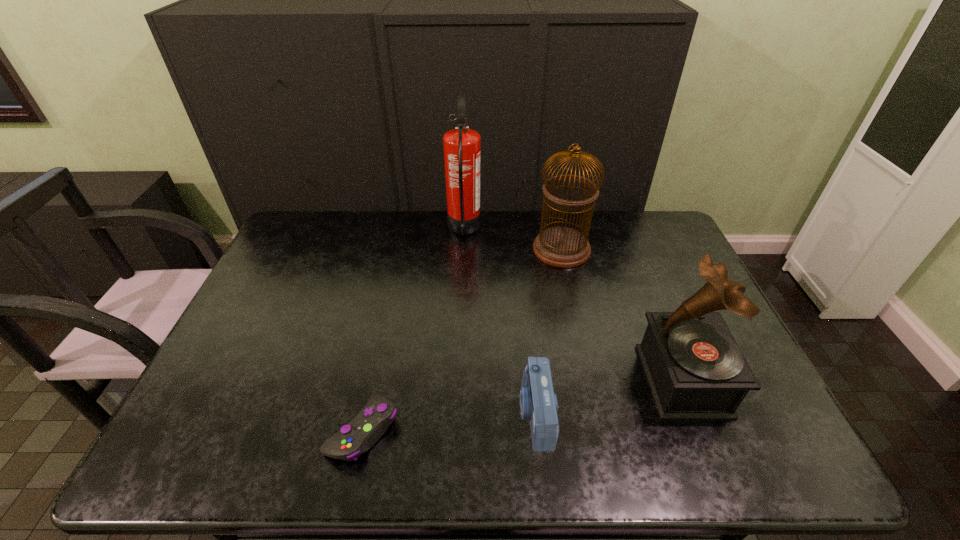
What are the coordinates of `free space located on the front-facing side of the fourth object from left to right` in the screenshot? It's located at (433, 249).

Where is `free region located 0.340m at the horn opening of the rightmost object`? This screenshot has height=540, width=960. free region located 0.340m at the horn opening of the rightmost object is located at coordinates click(511, 381).

Image resolution: width=960 pixels, height=540 pixels. Find the location of `vacant space located at the horn opening of the rightmost object`. vacant space located at the horn opening of the rightmost object is located at coordinates (495, 381).

The image size is (960, 540). What are the coordinates of `blank space located 0.110m at the horn opening of the rightmost object` in the screenshot? It's located at (602, 381).

Find the location of a particular element. vacant space situated 0.080m on the lens of the camera is located at coordinates (487, 413).

The width and height of the screenshot is (960, 540). Find the location of `vacant position located 0.150m on the lens of the camera`. vacant position located 0.150m on the lens of the camera is located at coordinates point(457,413).

This screenshot has height=540, width=960. What are the coordinates of `free space located 0.160m on the lens of the camera` in the screenshot? It's located at (452, 413).

Where is `free space located on the right of the leftmost object`? free space located on the right of the leftmost object is located at coordinates (420, 430).

Locate an element on the screen. Image resolution: width=960 pixels, height=540 pixels. fire extinguisher that is at the far edge is located at coordinates (461, 145).

Locate an element on the screen. birdcage that is at the far edge is located at coordinates (565, 247).